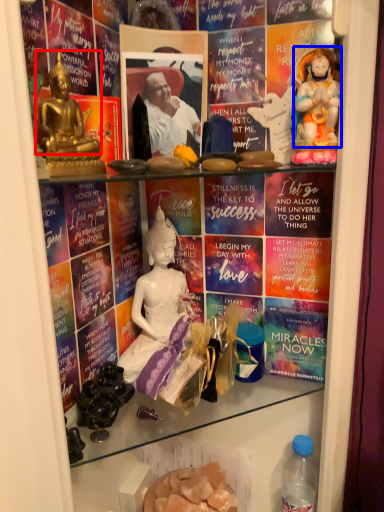
Question: Which object is further to the camera taking this photo, person (highlighted by a red box) or person (highlighted by a blue box)?

Choices:
 (A) person
 (B) person

Answer: (B)